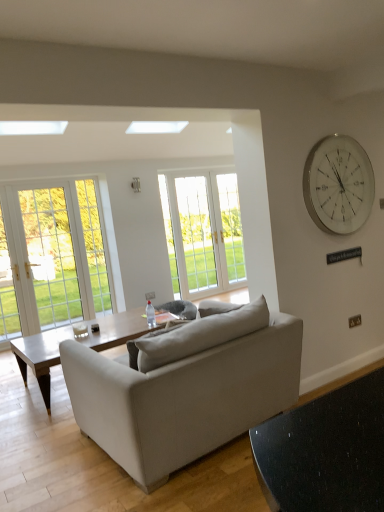
Question: Would you say white glass clock at upper right is to the left or to the right of clear glass bottle at center in the picture?

Choices:
 (A) left
 (B) right

Answer: (B)

Question: Is white glass clock at upper right bigger or smaller than clear glass bottle at center?

Choices:
 (A) small
 (B) big

Answer: (B)

Question: Which is farther from the light brown wooden coffee table at center?

Choices:
 (A) white glass window at center
 (B) white glass clock at upper right
 (C) clear glass bottle at center
 (D) beige fabric couch at center
 (E) white plastic power outlet at center

Answer: (B)

Question: Based on their relative distances, which object is farther from the light brown wooden coffee table at center?

Choices:
 (A) beige fabric couch at center
 (B) white glass window at center
 (C) white plastic power outlet at center
 (D) clear glass bottle at center
 (E) white glass clock at upper right

Answer: (E)